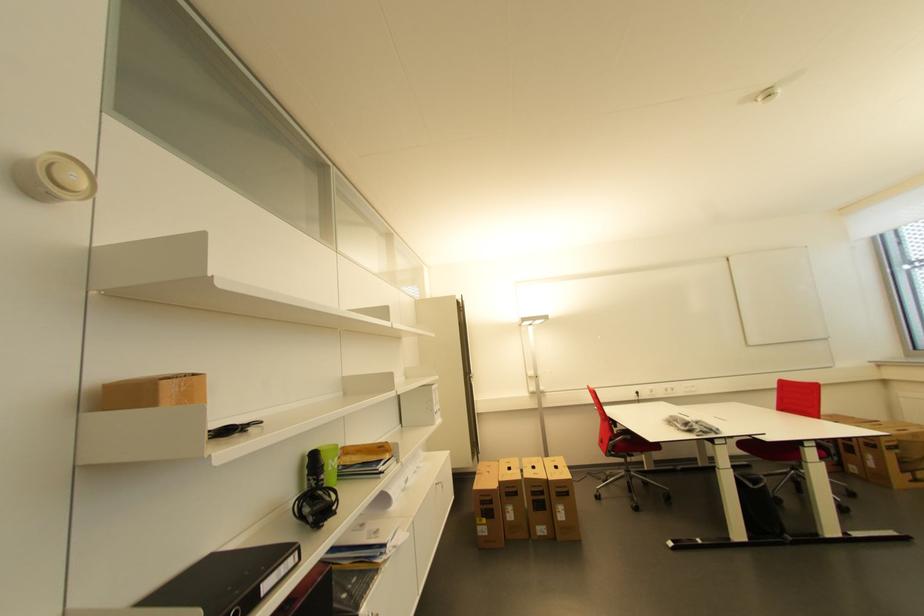
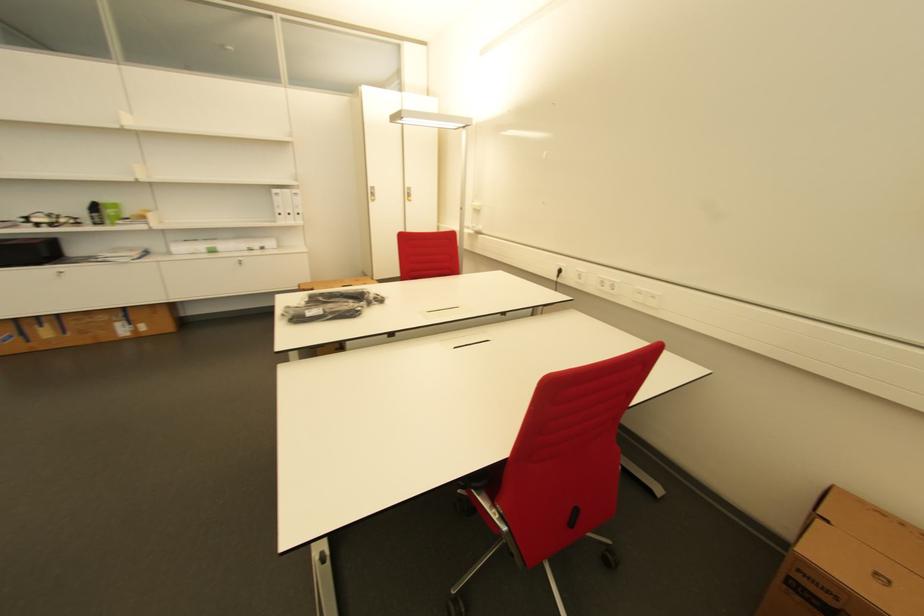
Question: I am providing you with two images of the same scene from different viewpoints. After the viewpoint changes to image2, which objects are now occluded?

Choices:
 (A) cabinet door lock
 (B) green plastic cup
 (C) white power outlet
 (D) none of these

Answer: (D)